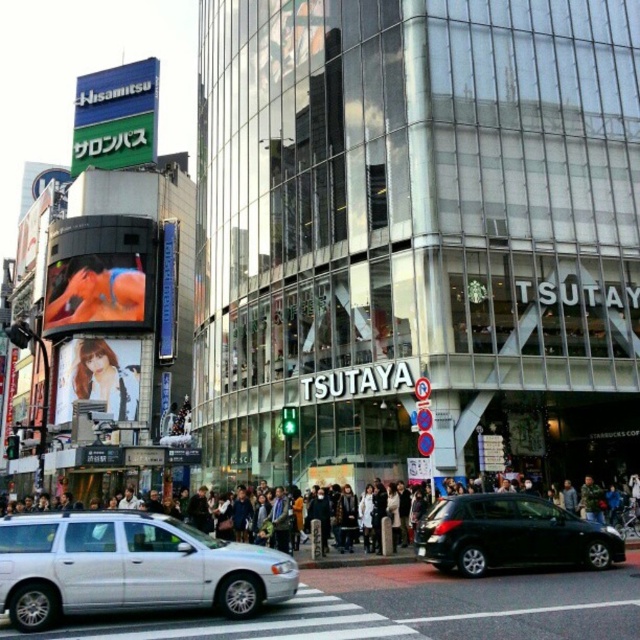
Question: Which point is farther to the camera?

Choices:
 (A) (540, 502)
 (B) (627, 541)
 (C) (120, 342)
 (D) (593, 500)

Answer: (C)

Question: Is green signboard at upper left to the right of dark gray concrete crowd at center from the viewer's perspective?

Choices:
 (A) no
 (B) yes

Answer: (A)

Question: Which of the following is the farthest from the observer?

Choices:
 (A) (241, 579)
 (B) (627, 540)

Answer: (B)

Question: Does silver metallic station wagon at center have a smaller size compared to camouflage jacket at center?

Choices:
 (A) no
 (B) yes

Answer: (A)

Question: Is silver metallic station wagon at center below dark gray concrete crowd at center?

Choices:
 (A) no
 (B) yes

Answer: (A)

Question: Which object appears closest to the camera in this image?

Choices:
 (A) dark gray concrete crowd at center
 (B) silver metallic station wagon at center
 (C) camouflage jacket at center
 (D) matte plastic billboard at center

Answer: (B)